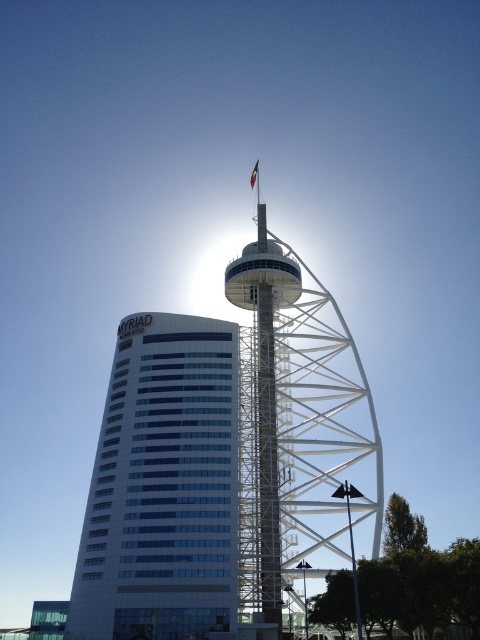
Question: Does white glass building at left appear on the right side of white metallic tower at center?

Choices:
 (A) no
 (B) yes

Answer: (A)

Question: Which point is farther to the camera?

Choices:
 (A) (228, 568)
 (B) (286, 520)

Answer: (B)

Question: Among these objects, which one is nearest to the camera?

Choices:
 (A) white glass building at left
 (B) white metallic tower at center

Answer: (B)

Question: Is white glass building at left further to camera compared to white metallic tower at center?

Choices:
 (A) no
 (B) yes

Answer: (B)

Question: Does white glass building at left have a greater width compared to white metallic tower at center?

Choices:
 (A) no
 (B) yes

Answer: (A)

Question: Among these objects, which one is nearest to the camera?

Choices:
 (A) white glass building at left
 (B) white metallic tower at center

Answer: (B)